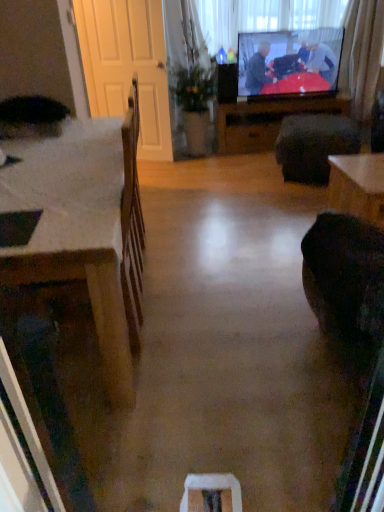
In the scene shown: Measure the distance between point (291, 110) and camera.

Point (291, 110) is 14.19 feet away from camera.

The image size is (384, 512). Describe the element at coordinates (361, 54) in the screenshot. I see `curtain at upper right` at that location.

What is the approximate width of green leafy plant at center?

green leafy plant at center is 29.32 centimeters wide.

You are a GUI agent. You are given a task and a screenshot of the screen. Output one action in this format:
    pyautogui.click(x=<x>, y=<y>)
    Task: Click on the wooden desk at left
    
    Given the screenshot: What is the action you would take?
    pyautogui.click(x=76, y=229)

Is wooden table at center, positioned as the second table in bottom-to-top order, inside curtain at upper right?

That's incorrect, wooden table at center, positioned as the second table in bottom-to-top order, is not inside curtain at upper right.

From a real-world perspective, is curtain at upper right on wooden table at center, positioned as the second table in bottom-to-top order?

Correct, in the physical world, curtain at upper right is higher than wooden table at center, positioned as the second table in bottom-to-top order.

Consider the image. Between curtain at upper right and wooden table at center, positioned as the second table in bottom-to-top order, which one has more height?

curtain at upper right.

Considering the relative sizes of curtain at upper right and wooden table at center, the first table when ordered from back to front, in the image provided, is curtain at upper right bigger than wooden table at center, the first table when ordered from back to front,?

Yes.

Based on the photo, is curtain at upper right oriented towards flat screen tv at upper center?

No, curtain at upper right is not aimed at flat screen tv at upper center.

From a real-world perspective, is curtain at upper right positioned above or below flat screen tv at upper center?

From a real-world perspective, curtain at upper right is physically below flat screen tv at upper center.

Would you say curtain at upper right is to the left or to the right of flat screen tv at upper center in the picture?

curtain at upper right is positioned on flat screen tv at upper center's right side.

Which is less distant, [344,17] or [307,88]?

The point [307,88] is closer to the camera.

Identify the location of curtain directly beneath the transparent plastic window screen at upper center (from a real-world perspective). (361, 54).

Is curtain at upper right further to the viewer compared to transparent plastic window screen at upper center?

No, the depth of curtain at upper right is less than that of transparent plastic window screen at upper center.

Does curtain at upper right have a greater width compared to transparent plastic window screen at upper center?

Correct, the width of curtain at upper right exceeds that of transparent plastic window screen at upper center.

Considering the relative sizes of wooden desk at left and flat screen tv at upper center in the image provided, is wooden desk at left taller than flat screen tv at upper center?

Correct, wooden desk at left is much taller as flat screen tv at upper center.

In the image, there is a flat screen tv at upper center. In order to click on desk below it (from a real-world perspective) in this screenshot , I will do `click(76, 229)`.

From a real-world perspective, who is located higher, wooden desk at left or flat screen tv at upper center?

From a 3D spatial view, flat screen tv at upper center is above.

Is curtain at upper right oriented towards dark fabric footrest at center?

No, curtain at upper right is not facing towards dark fabric footrest at center.

Which is more to the left, curtain at upper right or dark fabric footrest at center?

From the viewer's perspective, dark fabric footrest at center appears more on the left side.

Considering the positions of objects curtain at upper right and dark fabric footrest at center in the image provided, who is behind, curtain at upper right or dark fabric footrest at center?

curtain at upper right is behind.

Are curtain at upper right and dark fabric footrest at center far apart?

curtain at upper right is positioned a significant distance from dark fabric footrest at center.

Does point (220, 147) come in front of point (200, 15)?

No, it is behind (200, 15).

Is wooden table at center, the first table when ordered from back to front, positioned far away from transparent plastic window screen at upper center?

Yes, wooden table at center, the first table when ordered from back to front, and transparent plastic window screen at upper center are located far from each other.

Locate an element on the screen. window screen positioned vertically above the wooden table at center, arranged as the first table when viewed from the top (from a real-world perspective) is located at coordinates (262, 17).

Is wooden table at center, positioned as the second table in bottom-to-top order, inside or outside of transparent plastic window screen at upper center?

wooden table at center, positioned as the second table in bottom-to-top order, is spatially situated outside transparent plastic window screen at upper center.

Could white wooden screen door at left be considered to be inside curtain at upper right?

No, white wooden screen door at left is not a part of curtain at upper right.

Is curtain at upper right facing away from white wooden screen door at left?

That's not correct — curtain at upper right is not looking away from white wooden screen door at left.

Which is more to the left, curtain at upper right or white wooden screen door at left?

white wooden screen door at left is more to the left.

In the scene shown: Are curtain at upper right and white wooden screen door at left far apart?

Absolutely, curtain at upper right is distant from white wooden screen door at left.

The width and height of the screenshot is (384, 512). I want to click on curtain above the wooden table at center, positioned as the second table in bottom-to-top order (from the image's perspective), so click(x=361, y=54).

Locate an element on the screen. television located above the curtain at upper right (from a real-world perspective) is located at coordinates (289, 62).

Which object lies nearer to the anchor point wooden desk at left, wooden table at center, positioned as the second table in bottom-to-top order, or flat screen tv at upper center?

The object closer to wooden desk at left is wooden table at center, positioned as the second table in bottom-to-top order.

Looking at the image, which one is located closer to curtain at upper right, white wooden screen door at left or wooden table at lower right, the second table when ordered from back to front?

Based on the image, wooden table at lower right, the second table when ordered from back to front, appears to be nearer to curtain at upper right.

When comparing their distances from wooden table at center, positioned as the 2th table in front-to-back order, does green leafy plant at center or white wooden screen door at left seem further?

white wooden screen door at left.

From the image, which object appears to be nearer to white wooden screen door at left, dark fabric footrest at center or wooden table at center, the first table when ordered from back to front?

wooden table at center, the first table when ordered from back to front, lies closer to white wooden screen door at left than the other object.

Based on their spatial positions, is dark fabric footrest at center or curtain at upper right closer to wooden table at lower right, which appears as the second table when viewed from the top?

Based on the image, dark fabric footrest at center appears to be nearer to wooden table at lower right, which appears as the second table when viewed from the top.

Estimate the real-world distances between objects in this image. Which object is closer to wooden table at center, arranged as the first table when viewed from the top, wooden desk at left or curtain at upper right?

The object closer to wooden table at center, arranged as the first table when viewed from the top, is curtain at upper right.

Looking at the image, which one is located closer to dark fabric footrest at center, green leafy plant at center or flat screen tv at upper center?

flat screen tv at upper center is positioned closer to the anchor dark fabric footrest at center.

Which object lies further to the anchor point wooden table at center, positioned as the second table in bottom-to-top order, flat screen tv at upper center or wooden desk at left?

wooden desk at left is further to wooden table at center, positioned as the second table in bottom-to-top order.

The height and width of the screenshot is (512, 384). I want to click on screen door positioned between wooden desk at left and flat screen tv at upper center from near to far, so click(127, 66).

Where is `footrest between white wooden screen door at left and wooden table at lower right, which appears as the second table when viewed from the top, from left to right`? The width and height of the screenshot is (384, 512). footrest between white wooden screen door at left and wooden table at lower right, which appears as the second table when viewed from the top, from left to right is located at coordinates (314, 145).

The width and height of the screenshot is (384, 512). I want to click on television between transparent plastic window screen at upper center and wooden table at center, positioned as the 2th table in front-to-back order, in the up-down direction, so click(289, 62).

Where is `curtain between wooden desk at left and wooden table at center, the first table when ordered from back to front, along the z-axis`? Image resolution: width=384 pixels, height=512 pixels. curtain between wooden desk at left and wooden table at center, the first table when ordered from back to front, along the z-axis is located at coordinates (361, 54).